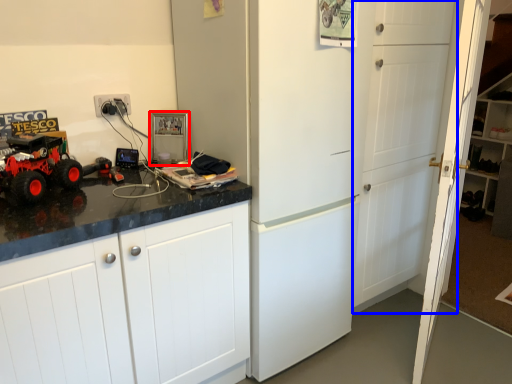
Question: Which object is closer to the camera taking this photo, appliance (highlighted by a red box) or door (highlighted by a blue box)?

Choices:
 (A) appliance
 (B) door

Answer: (B)